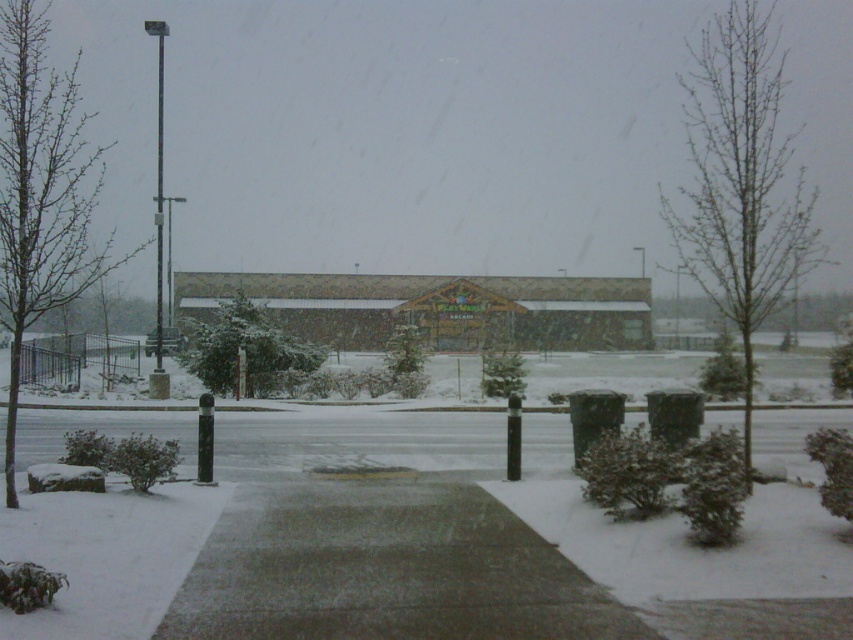
You are a delivery person trying to navigate through the snow. You see the gray concrete sidewalk at center and the metallic pole at left. Which one takes up more space in the image?

The metallic pole at left takes up more space in the image than the gray concrete sidewalk at center because the gray concrete sidewalk at center occupies less space than metallic pole at left.

You are a delivery person with a cart that is 2 meters wide. You need to move from the gray concrete sidewalk at center to the metallic pole at left. Is there enough space between them for your cart to pass through?

The distance between the gray concrete sidewalk at center and the metallic pole at left is 35.49 meters, so yes, there is more than enough space for a 2 meter wide cart to pass through.